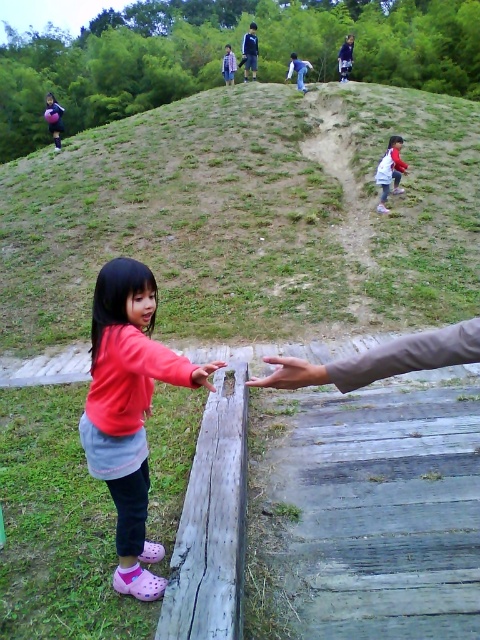
Question: Is the position of blue denim jeans at center more distant than that of light blue denim jacket at upper center?

Choices:
 (A) no
 (B) yes

Answer: (A)

Question: Which point appears closest to the camera in this image?

Choices:
 (A) (380, 179)
 (B) (143, 314)
 (C) (297, 378)
 (D) (47, 115)

Answer: (C)

Question: From the image, what is the correct spatial relationship of matte pink hoodie at upper right in relation to light blue denim jacket at upper center?

Choices:
 (A) above
 (B) below

Answer: (B)

Question: Is matte pink hoodie at upper right behind dark blue denim jacket at upper center?

Choices:
 (A) no
 (B) yes

Answer: (A)

Question: Which point appears farthest from the camera in this image?

Choices:
 (A) [348, 38]
 (B) [127, 412]
 (C) [224, 58]

Answer: (C)

Question: Estimate the real-world distances between objects in this image. Which object is closer to the light blue denim jacket at upper center?

Choices:
 (A) wooden hand at center
 (B) dark blue denim jacket at upper center
 (C) matte pink hoodie at upper right

Answer: (B)